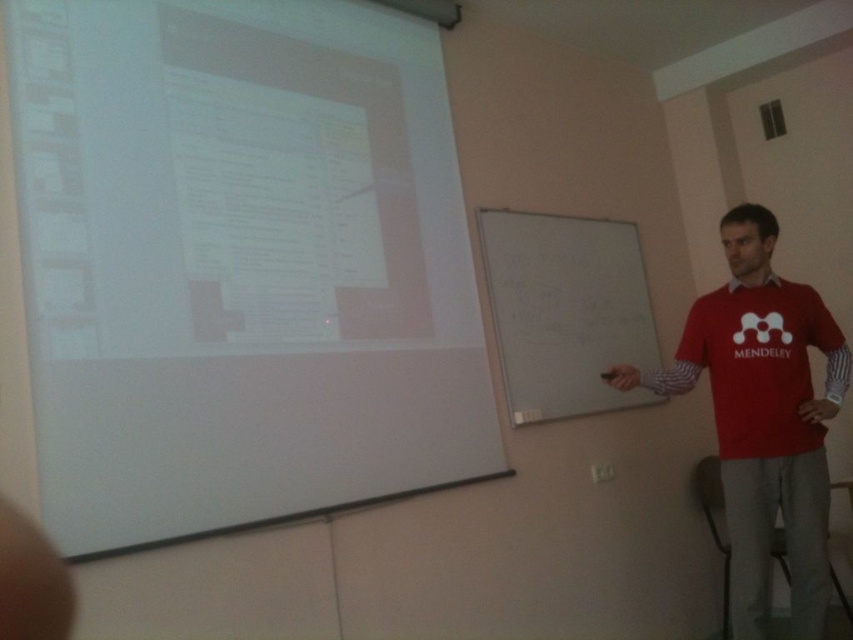
Question: Estimate the real-world distances between objects in this image. Which object is closer to the red matte shirt at right?

Choices:
 (A) whiteboard at center
 (B) red cotton shirt at right
 (C) white matte projection screen at upper left

Answer: (B)

Question: Does whiteboard at center appear on the left side of red matte shirt at right?

Choices:
 (A) yes
 (B) no

Answer: (A)

Question: Which of the following is the farthest from the observer?

Choices:
 (A) red matte shirt at right
 (B) red cotton shirt at right

Answer: (A)

Question: Can you confirm if white matte projection screen at upper left is positioned above whiteboard at center?

Choices:
 (A) yes
 (B) no

Answer: (A)

Question: Which object is positioned closest to the red cotton shirt at right?

Choices:
 (A) red matte shirt at right
 (B) white matte projection screen at upper left

Answer: (A)

Question: Does white matte projection screen at upper left appear on the right side of red cotton shirt at right?

Choices:
 (A) yes
 (B) no

Answer: (B)